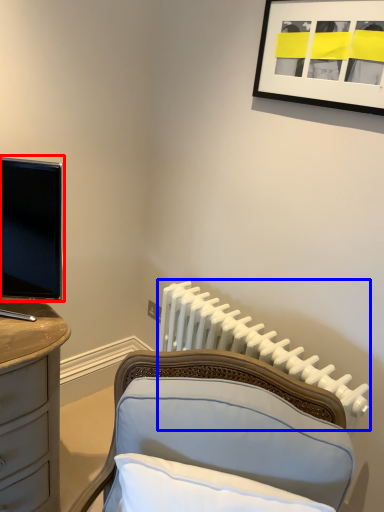
Question: Which point is closer to the camera, television (highlighted by a red box) or radiator (highlighted by a blue box)?

Choices:
 (A) television
 (B) radiator

Answer: (A)